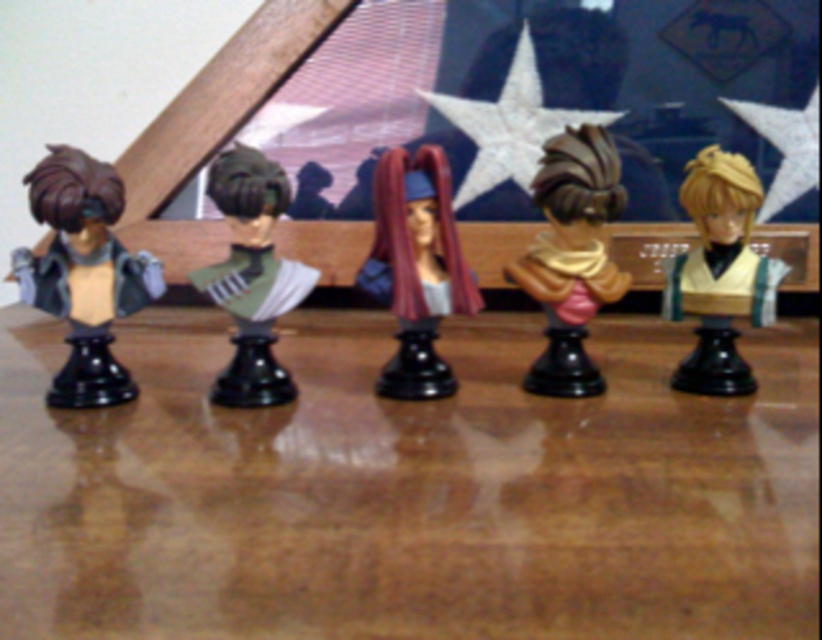
Based on the photo, you are a photographer standing at the camera position. You want to take a closeup photo of the satin burgundy hair at center. Is the camera close enough to capture the entire hair in the frame?

The distance between the satin burgundy hair at center and the camera is 31.02 inches. Since the camera can focus clearly at that distance, you can take a closeup photo of the satin burgundy hair at center.